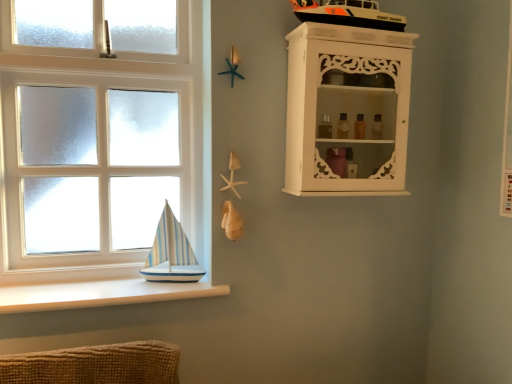
What do you see at coordinates (170, 253) in the screenshot? The height and width of the screenshot is (384, 512). I see `striped sailboat at window sill` at bounding box center [170, 253].

Looking at this image, measure the distance between white carved cabinet at upper right and camera.

white carved cabinet at upper right and camera are 1.31 meters apart from each other.

This screenshot has height=384, width=512. What do you see at coordinates (347, 110) in the screenshot?
I see `white carved cabinet at upper right` at bounding box center [347, 110].

The image size is (512, 384). Identify the location of white smooth ledge at lower left. (100, 294).

What are the coordinates of `striped sailboat at window sill` in the screenshot? It's located at (170, 253).

Which is behind, point (77, 287) or point (337, 135)?

The point (337, 135) is farther.

Is white smooth ledge at lower left next to white carved cabinet at upper right?

No, white smooth ledge at lower left is not beside white carved cabinet at upper right.

How far apart are white smooth ledge at lower left and white carved cabinet at upper right?

A distance of 72.34 centimeters exists between white smooth ledge at lower left and white carved cabinet at upper right.

Can you confirm if white smooth ledge at lower left is smaller than white carved cabinet at upper right?

Correct, white smooth ledge at lower left occupies less space than white carved cabinet at upper right.

The image size is (512, 384). I want to click on shelf above the striped sailboat at window sill (from a real-world perspective), so click(347, 110).

Is white carved cabinet at upper right aimed at striped sailboat at window sill?

No.

Can you see white carved cabinet at upper right touching striped sailboat at window sill?

There is a gap between white carved cabinet at upper right and striped sailboat at window sill.

Between white carved cabinet at upper right and striped sailboat at window sill, which one has smaller size?

striped sailboat at window sill.

From the image's perspective, between white wooden window at left and striped sailboat at window sill, who is located below?

striped sailboat at window sill is shown below in the image.

How different are the orientations of white wooden window at left and striped sailboat at window sill in degrees?

0.598 degrees.

From a real-world perspective, is white wooden window at left on striped sailboat at window sill?

Correct, in the physical world, white wooden window at left is higher than striped sailboat at window sill.

Is white wooden window at left in front of or behind striped sailboat at window sill in the image?

In the image, white wooden window at left appears in front of striped sailboat at window sill.

Who is smaller, white carved cabinet at upper right or white wooden window at left?

white carved cabinet at upper right.

From a real-world perspective, who is located lower, white carved cabinet at upper right or white wooden window at left?

white wooden window at left, from a real-world perspective.

Measure the distance between white carved cabinet at upper right and white wooden window at left.

white carved cabinet at upper right and white wooden window at left are 23.70 inches apart from each other.

Which is correct: white carved cabinet at upper right is inside white wooden window at left, or outside of it?

white carved cabinet at upper right is not enclosed by white wooden window at left.

From the image's perspective, which is below, striped sailboat at window sill or white wooden window at left?

striped sailboat at window sill, from the image's perspective.

From a real-world perspective, is striped sailboat at window sill over white wooden window at left?

Actually, striped sailboat at window sill is physically below white wooden window at left in the real world.

Which object is positioned more to the left, striped sailboat at window sill or white wooden window at left?

white wooden window at left.

Considering the positions of points (149, 262) and (22, 150), is point (149, 262) closer to camera compared to point (22, 150)?

No.

Is white carved cabinet at upper right facing away from white smooth ledge at lower left?

That's not correct — white carved cabinet at upper right is not looking away from white smooth ledge at lower left.

What's the angular difference between white carved cabinet at upper right and white smooth ledge at lower left's facing directions?

0.000494 degrees separate the facing orientations of white carved cabinet at upper right and white smooth ledge at lower left.

Are white carved cabinet at upper right and white smooth ledge at lower left located far from each other?

white carved cabinet at upper right is actually quite close to white smooth ledge at lower left.

Which is in front, point (348, 72) or point (118, 283)?

Point (348, 72)

From a real-world perspective, is striped sailboat at window sill on white carved cabinet at upper right?

No.

Is the surface of striped sailboat at window sill in direct contact with white carved cabinet at upper right?

No, striped sailboat at window sill is not beside white carved cabinet at upper right.

Is striped sailboat at window sill thinner than white carved cabinet at upper right?

Correct, the width of striped sailboat at window sill is less than that of white carved cabinet at upper right.

Where is `ledge that appears below the white carved cabinet at upper right (from a real-world perspective)`? The height and width of the screenshot is (384, 512). ledge that appears below the white carved cabinet at upper right (from a real-world perspective) is located at coordinates (100, 294).

In order to click on boat that is below the white carved cabinet at upper right (from the image's perspective) in this screenshot , I will do `click(170, 253)`.

Which object lies nearer to the anchor point white smooth ledge at lower left, striped sailboat at window sill or white wooden window at left?

striped sailboat at window sill lies closer to white smooth ledge at lower left than the other object.

Based on their spatial positions, is white wooden window at left or striped sailboat at window sill closer to white smooth ledge at lower left?

Based on the image, striped sailboat at window sill appears to be nearer to white smooth ledge at lower left.

Estimate the real-world distances between objects in this image. Which object is closer to striped sailboat at window sill, white smooth ledge at lower left or white carved cabinet at upper right?

white smooth ledge at lower left.

Looking at the image, which one is located closer to white wooden window at left, striped sailboat at window sill or white smooth ledge at lower left?

striped sailboat at window sill lies closer to white wooden window at left than the other object.

Looking at this image, looking at the image, which one is located closer to white carved cabinet at upper right, striped sailboat at window sill or white smooth ledge at lower left?

Among the two, striped sailboat at window sill is located nearer to white carved cabinet at upper right.

Looking at the image, which one is located further to striped sailboat at window sill, white wooden window at left or white smooth ledge at lower left?

white wooden window at left is positioned further to the anchor striped sailboat at window sill.

When comparing their distances from white smooth ledge at lower left, does white carved cabinet at upper right or striped sailboat at window sill seem further?

white carved cabinet at upper right.

Based on their spatial positions, is white wooden window at left or white carved cabinet at upper right closer to white smooth ledge at lower left?

white wooden window at left is closer to white smooth ledge at lower left.

You are a GUI agent. You are given a task and a screenshot of the screen. Output one action in this format:
    pyautogui.click(x=<x>, y=<y>)
    Task: Click on the boat situated between white smooth ledge at lower left and white carved cabinet at upper right from left to right
    This screenshot has width=512, height=384.
    Given the screenshot: What is the action you would take?
    pyautogui.click(x=170, y=253)

Image resolution: width=512 pixels, height=384 pixels. I want to click on boat that lies between white wooden window at left and white smooth ledge at lower left from top to bottom, so click(170, 253).

Identify the location of boat between white wooden window at left and white carved cabinet at upper right in the horizontal direction. The image size is (512, 384). (170, 253).

What are the coordinates of `ledge situated between white wooden window at left and white carved cabinet at upper right from left to right` in the screenshot? It's located at [x=100, y=294].